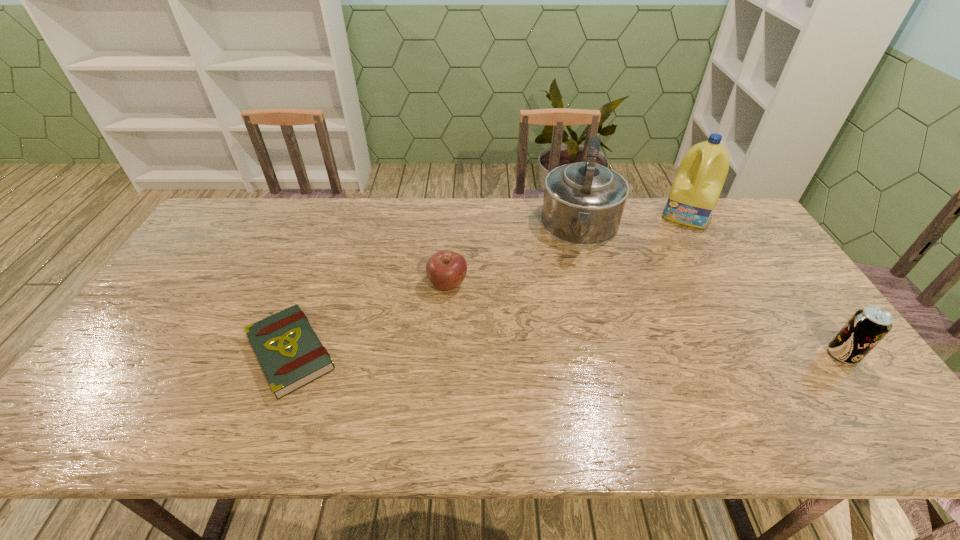
This screenshot has width=960, height=540. I want to click on vacant spot on the desktop that is between the leftmost object and the soda can and is positioned on the side of the third nearest object with the unique marking, so click(x=509, y=353).

Find the location of a particular element. This screenshot has height=540, width=960. free space on the desktop that is between the book and the rightmost object and is positioned with the spout at the front of the kettle is located at coordinates (568, 354).

Where is `vacant spot on the desktop that is between the leftmost object and the soda can and is positioned on the label of the detergent`? vacant spot on the desktop that is between the leftmost object and the soda can and is positioned on the label of the detergent is located at coordinates (638, 354).